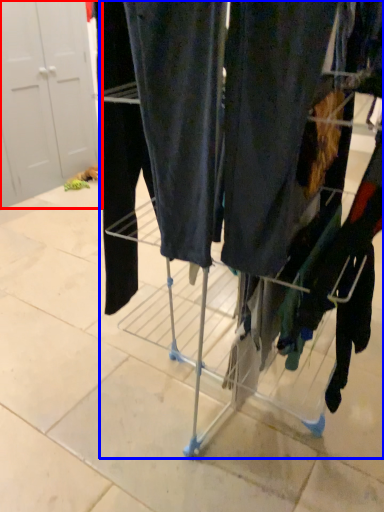
Question: Which object appears farthest to the camera in this image, door (highlighted by a red box) or trolley (highlighted by a blue box)?

Choices:
 (A) door
 (B) trolley

Answer: (A)